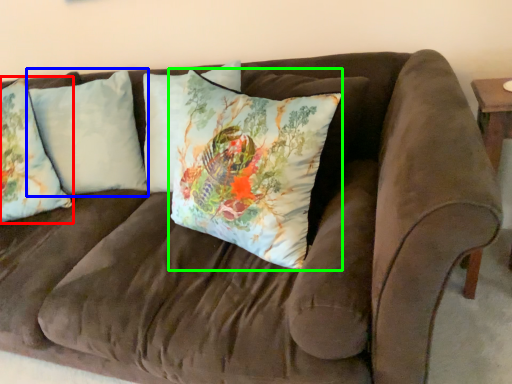
Question: Which object is positioned farthest from pillow (highlighted by a red box)? Select from pillow (highlighted by a blue box) and pillow (highlighted by a green box).

Choices:
 (A) pillow
 (B) pillow

Answer: (B)